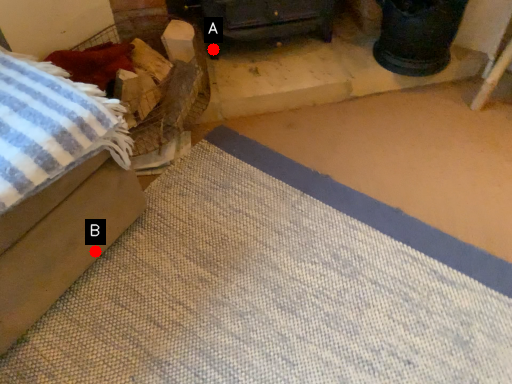
Question: Two points are circled on the image, labeled by A and B beside each circle. Which point is closer to the camera?

Choices:
 (A) A is closer
 (B) B is closer

Answer: (B)